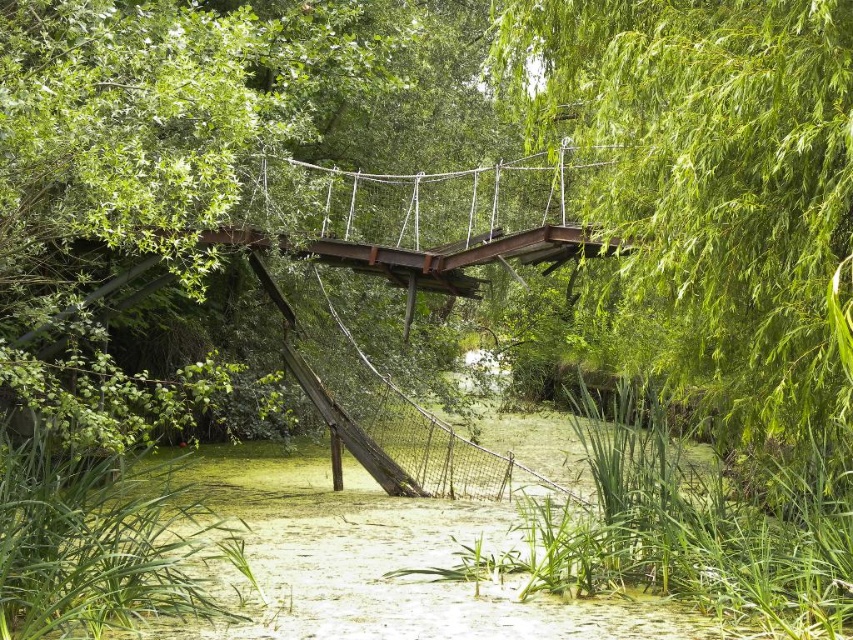
Question: Does green leafy tree at upper right appear under rusty metal suspension bridge at center?

Choices:
 (A) no
 (B) yes

Answer: (A)

Question: Among these objects, which one is farthest from the camera?

Choices:
 (A) green leafy tree at upper right
 (B) rusty metal suspension bridge at center

Answer: (B)

Question: Is green leafy tree at upper right closer to the viewer compared to rusty metal suspension bridge at center?

Choices:
 (A) yes
 (B) no

Answer: (A)

Question: Which point is closer to the camera?

Choices:
 (A) (577, 113)
 (B) (431, 234)

Answer: (A)

Question: Can you confirm if green leafy tree at upper right is positioned to the right of rusty metal suspension bridge at center?

Choices:
 (A) yes
 (B) no

Answer: (A)